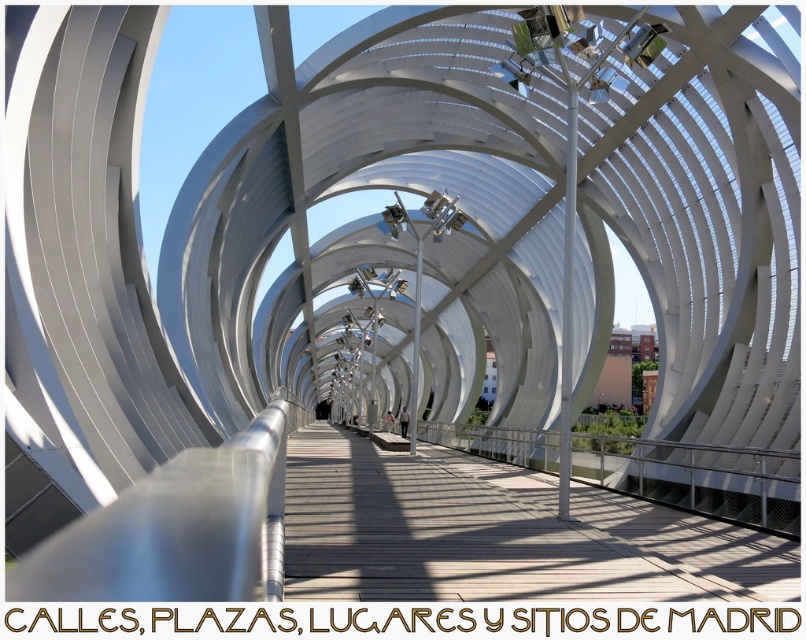
Who is shorter, wooden walkway at center or silver metallic rail at center?

wooden walkway at center

Find the location of a particular element. The width and height of the screenshot is (806, 640). wooden walkway at center is located at coordinates (499, 534).